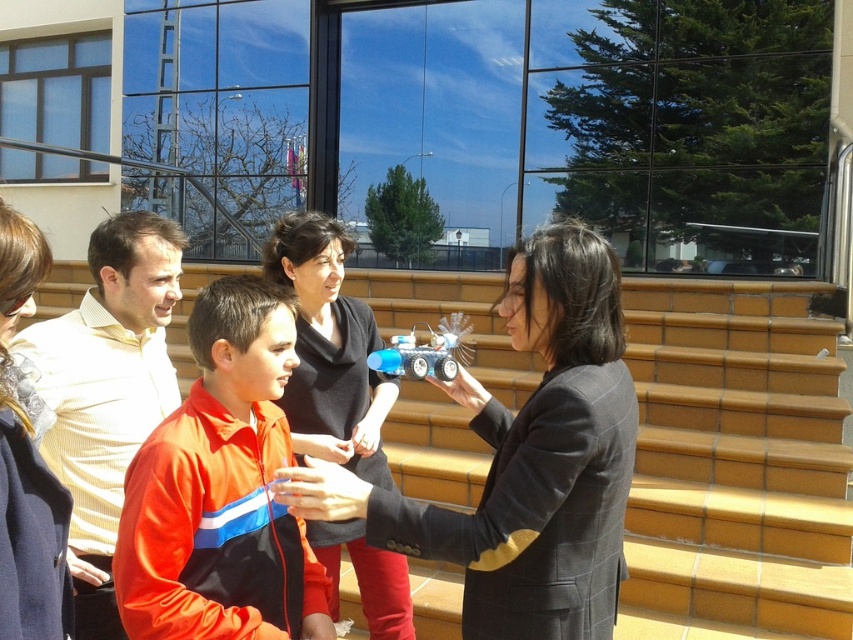
Question: Where is matte black jacket at center located in relation to black matte jacket at center in the image?

Choices:
 (A) above
 (B) below

Answer: (A)

Question: Is orange fabric jacket at center wider than yellow striped shirt at left?

Choices:
 (A) yes
 (B) no

Answer: (B)

Question: Which object is positioned closest to the black matte jacket at center?

Choices:
 (A) yellow striped shirt at left
 (B) orange fleece jacket at lower left
 (C) orange fabric jacket at center

Answer: (A)

Question: Which point is closer to the camera?

Choices:
 (A) (500, 520)
 (B) (80, 342)
 (C) (22, 608)
 (D) (351, 545)

Answer: (C)

Question: Which point is farther from the camera taking this photo?

Choices:
 (A) (610, 419)
 (B) (131, 337)
 (C) (4, 515)
 (D) (310, 632)

Answer: (B)

Question: Can you confirm if matte black jacket at center is positioned to the left of orange fleece jacket at lower left?

Choices:
 (A) no
 (B) yes

Answer: (A)